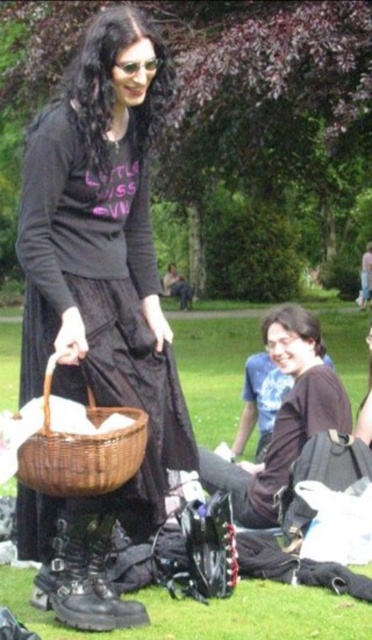
Question: In this image, where is matte black dress at center located relative to black leather boot at lower center?

Choices:
 (A) below
 (B) above

Answer: (B)

Question: Observing the image, what is the correct spatial positioning of green grass at lower center in reference to black leather boot at lower center?

Choices:
 (A) left
 (B) right

Answer: (B)

Question: Can you confirm if brown leather jacket at lower center is positioned to the left of black leather boot at lower center?

Choices:
 (A) yes
 (B) no

Answer: (B)

Question: Which object appears closest to the camera in this image?

Choices:
 (A) brown leather jacket at lower center
 (B) matte black dress at center
 (C) black leather boot at lower center

Answer: (B)

Question: Which of the following is the farthest from the observer?

Choices:
 (A) green grass at lower center
 (B) woven brown basket at lower left

Answer: (A)

Question: Among these points, which one is nearest to the camera?

Choices:
 (A) (88, 109)
 (B) (329, 392)

Answer: (A)